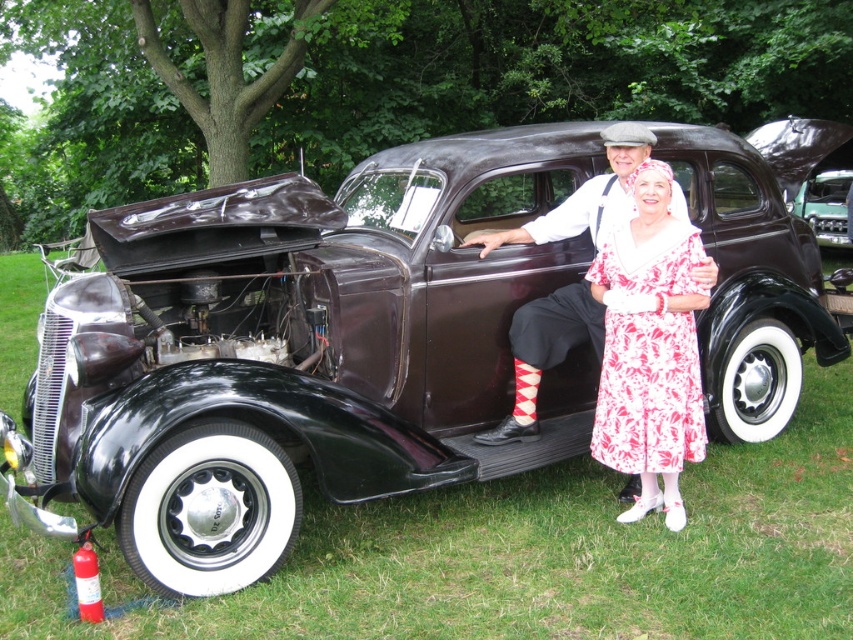
You are organizing a car show and need to display two dresses next to the vintage car. The floral cotton dress at center and the printed cotton dress at center must be placed on a stand. Which dress should be placed lower on the stand to ensure both are visible?

The floral cotton dress at center should be placed lower on the stand because it is positioned under the printed cotton dress at center, so placing it lower will help both dresses be visible.